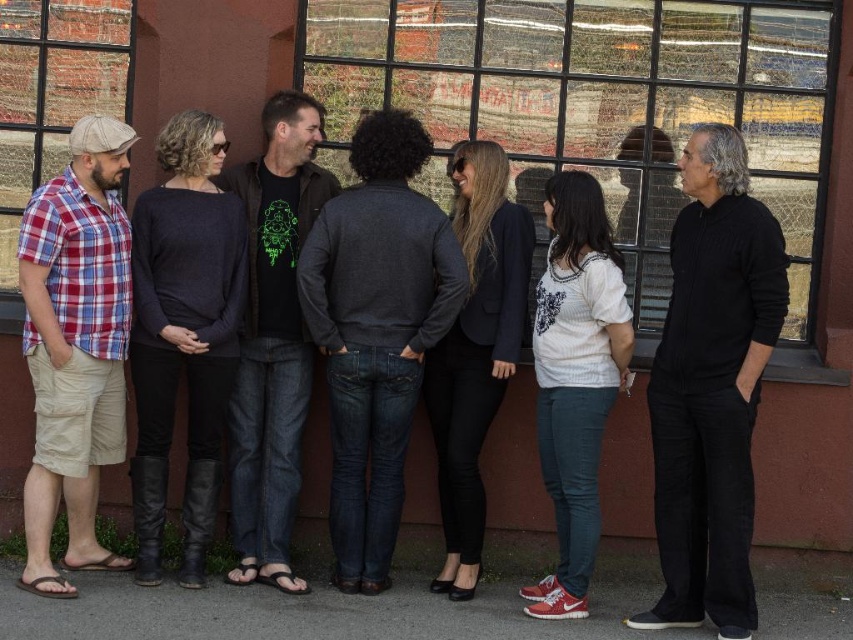
Question: Does dark gray sweater at center appear on the right side of matte glass window at left?

Choices:
 (A) no
 (B) yes

Answer: (B)

Question: Is plaid cotton shirt at left to the right of matte glass window at left from the viewer's perspective?

Choices:
 (A) yes
 (B) no

Answer: (A)

Question: Among these objects, which one is farthest from the camera?

Choices:
 (A) dark gray sweater at center
 (B) matte glass window at left
 (C) plaid cotton shirt at left
 (D) black matte sweater at right

Answer: (B)

Question: Among these points, which one is nearest to the camera?

Choices:
 (A) (335, 122)
 (B) (67, 48)
 (C) (113, 250)

Answer: (C)

Question: Is black matte sweater at right smaller than matte glass window at left?

Choices:
 (A) no
 (B) yes

Answer: (A)

Question: Among these points, which one is nearest to the camera?

Choices:
 (A) (73, 556)
 (B) (769, 316)
 (C) (546, 131)

Answer: (B)